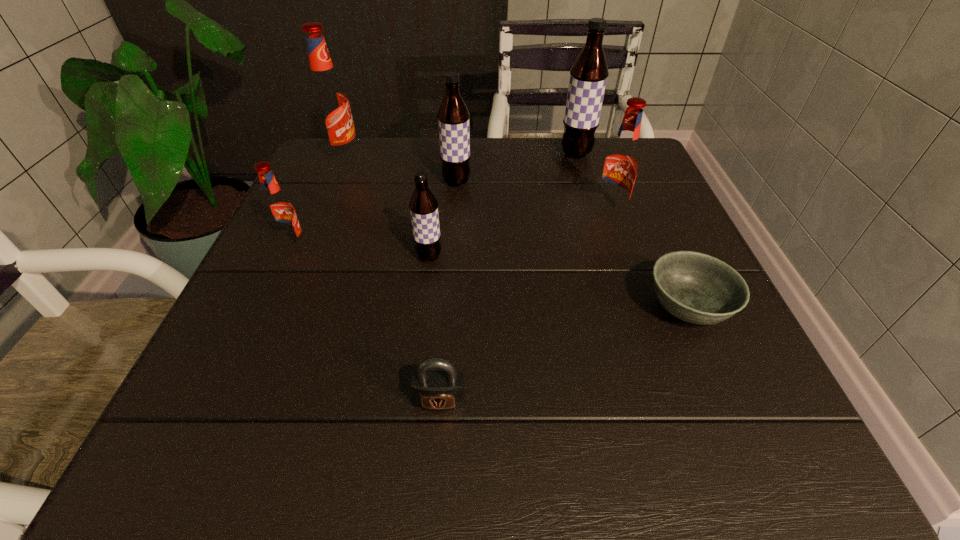
The height and width of the screenshot is (540, 960). Find the location of `object that is at the near edge`. object that is at the near edge is located at coordinates (436, 385).

Identify the location of bowl present at the right edge. (697, 288).

Locate an element on the screen. object located at the far left corner is located at coordinates (329, 101).

Image resolution: width=960 pixels, height=540 pixels. I want to click on object that is at the far right corner, so click(x=588, y=76).

This screenshot has height=540, width=960. I want to click on vacant space at the far edge of the desktop, so pyautogui.click(x=579, y=181).

In the image, there is a desktop. Identify the location of vacant space at the near edge. (503, 428).

Find the location of a particular element. The width and height of the screenshot is (960, 540). vacant space at the left edge is located at coordinates (345, 259).

Identify the location of vacant region at the right edge. (652, 259).

Image resolution: width=960 pixels, height=540 pixels. In order to click on vacant region at the far left corner of the desktop in this screenshot , I will do `click(364, 178)`.

Where is `free point at the far right corner`? free point at the far right corner is located at coordinates (639, 185).